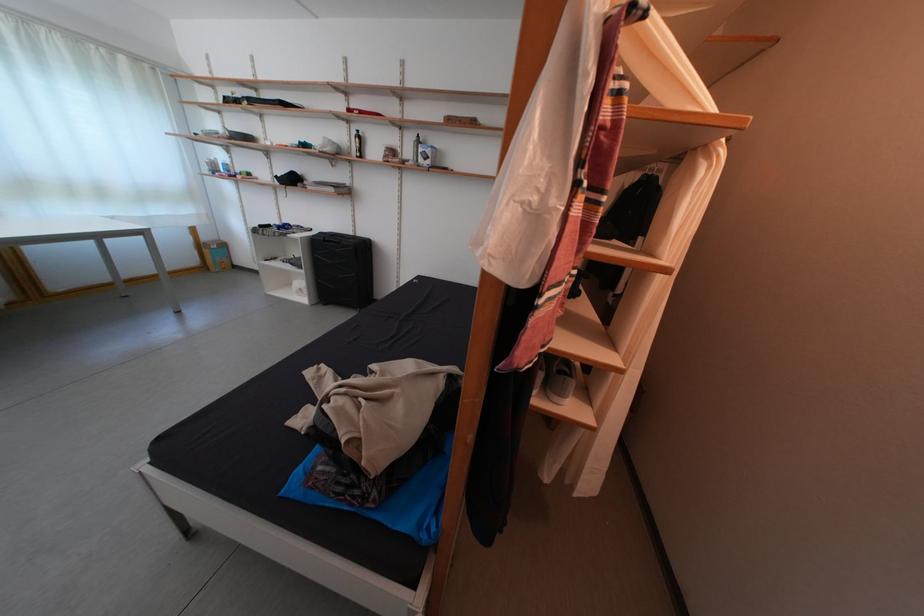
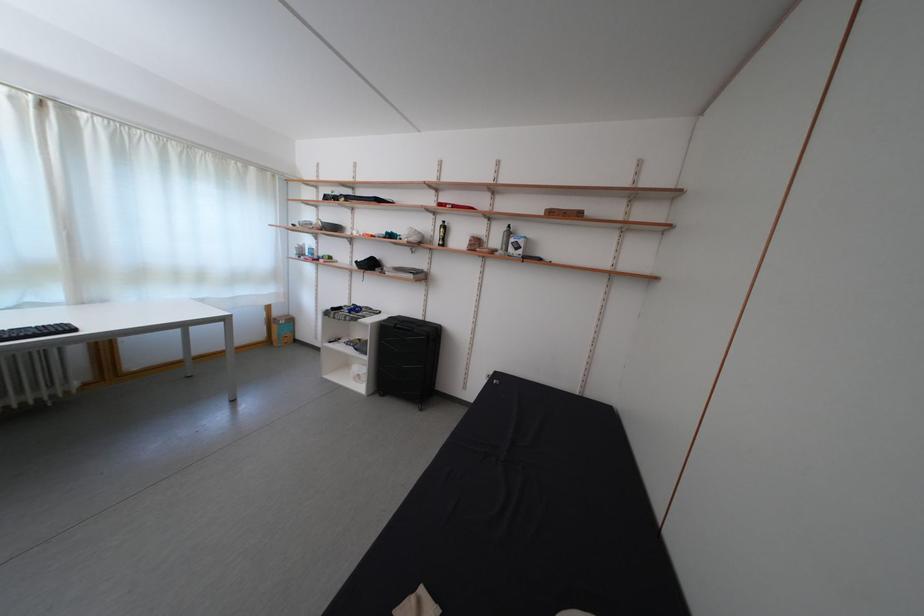
The images are taken continuously from a first-person perspective. In which direction are you moving?

The movement direction of the cameraman is left, forward.